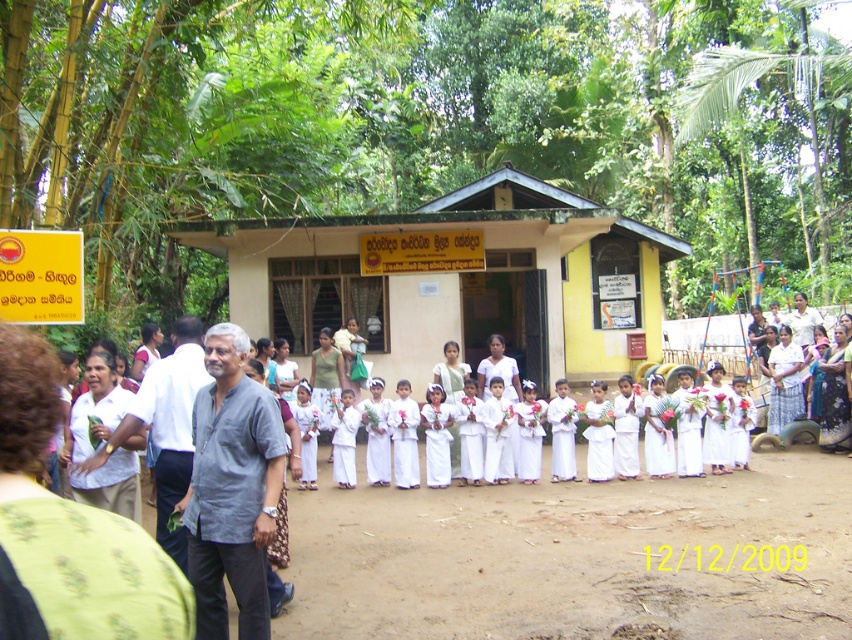
Who is taller, beige painted wood hut at center or white matte shirt at left?

Standing taller between the two is beige painted wood hut at center.

Is beige painted wood hut at center thinner than white matte shirt at left?

Incorrect, beige painted wood hut at center's width is not less than white matte shirt at left's.

Where is `beige painted wood hut at center`? This screenshot has width=852, height=640. beige painted wood hut at center is located at coordinates (455, 280).

Which of these two, gray cotton shirt at center or white matte shirt at left, stands shorter?

Standing shorter between the two is white matte shirt at left.

The width and height of the screenshot is (852, 640). Identify the location of gray cotton shirt at center. (231, 490).

Who is more distant from viewer, (258, 634) or (72, 436)?

The point (72, 436) is behind.

Identify the location of gray cotton shirt at center. The width and height of the screenshot is (852, 640). [231, 490].

Is point (775, 422) positioned before point (563, 397)?

That is False.

Which is behind, point (769, 365) or point (563, 408)?

The point (769, 365) is behind.

Image resolution: width=852 pixels, height=640 pixels. What are the coordinates of `white cotton robe at center` in the screenshot? It's located at (784, 381).

I want to click on white cotton robe at center, so click(784, 381).